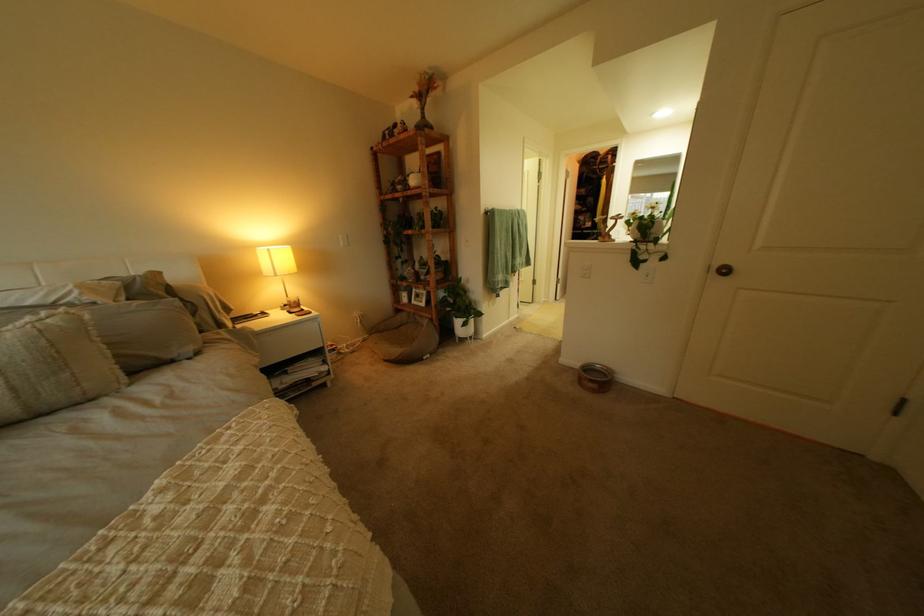
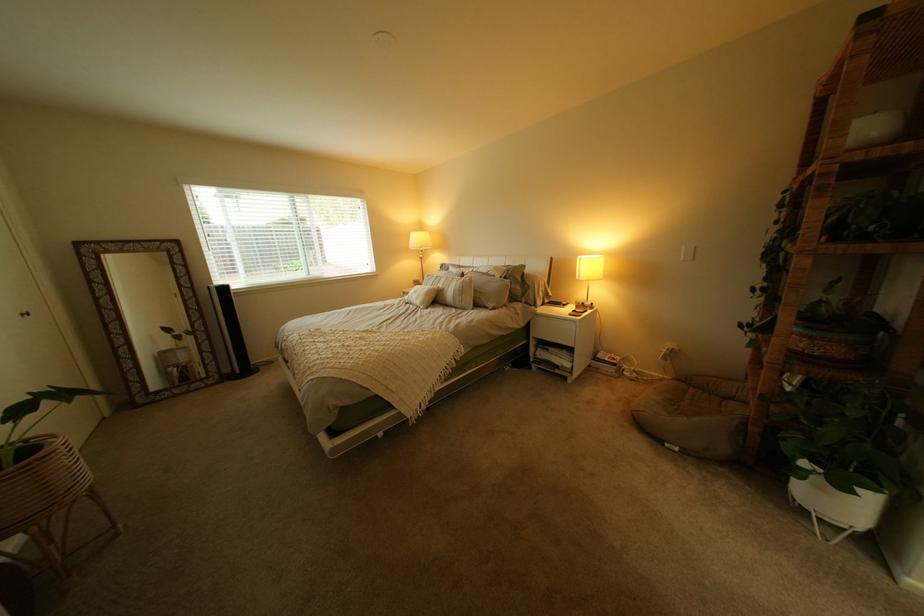
Where in the second image is the point corresponding to [66,322] from the first image?

(482, 280)